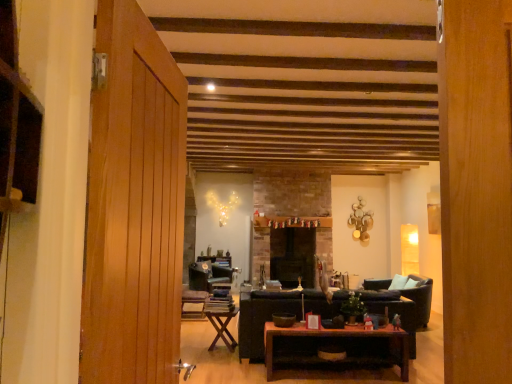
Question: Choose the correct answer: Is wooden textured chair at center, the second chair when ordered from back to front, inside wooden polished coffee table at center or outside it?

Choices:
 (A) outside
 (B) inside

Answer: (A)

Question: Would you say wooden textured chair at center, the second chair when ordered from back to front, is to the left or to the right of wooden polished coffee table at center in the picture?

Choices:
 (A) right
 (B) left

Answer: (B)

Question: Based on their relative distances, which object is nearer to the leather armchair at right?

Choices:
 (A) wooden folding table at center
 (B) black stone fireplace at center
 (C) wooden textured chair at center, the second chair when ordered from back to front
 (D) dark brown leather couch at center
 (E) velvet dark blue chair at center, marked as the second chair in a front-to-back arrangement

Answer: (D)

Question: Considering the real-world distances, which object is farthest from the wooden folding table at center?

Choices:
 (A) wooden polished coffee table at center
 (B) velvet dark blue chair at center, marked as the second chair in a front-to-back arrangement
 (C) black stone fireplace at center
 (D) wooden textured chair at center, the second chair when ordered from back to front
 (E) dark brown leather couch at center

Answer: (C)